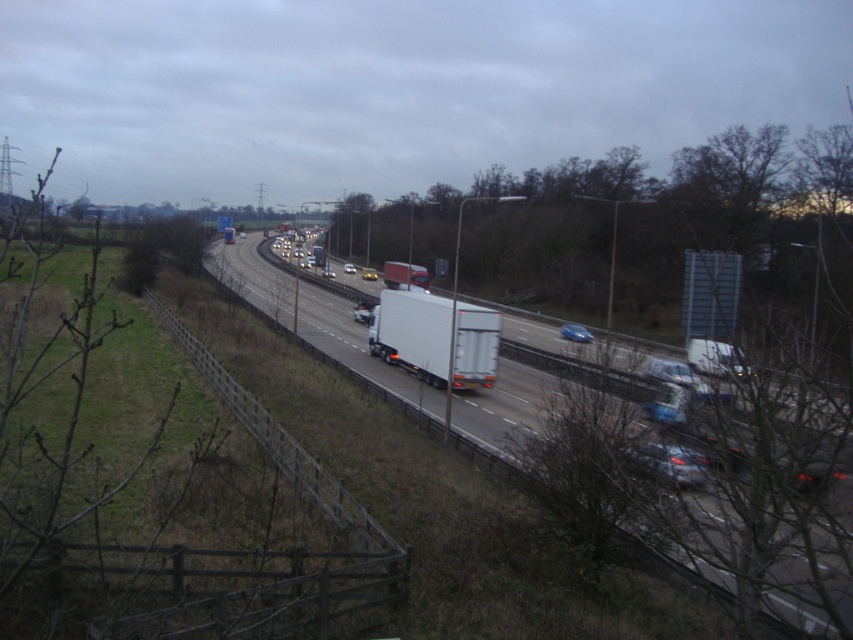
Is white matte trailer truck at center smaller than white matte truck at center?

No.

Is white matte trailer truck at center to the left of white matte truck at center from the viewer's perspective?

No, white matte trailer truck at center is not to the left of white matte truck at center.

Is point (392, 324) in front of point (363, 300)?

Yes, it is in front of point (363, 300).

Image resolution: width=853 pixels, height=640 pixels. I want to click on white matte trailer truck at center, so click(412, 332).

Between point (575, 333) and point (361, 300), which one is positioned in front?

Point (575, 333)

Does blue metallic sedan at center have a smaller size compared to white matte truck at center?

Correct, blue metallic sedan at center occupies less space than white matte truck at center.

Is point (566, 333) behind point (374, 304)?

No, (566, 333) is closer to viewer.

Where is `blue metallic sedan at center`? This screenshot has width=853, height=640. blue metallic sedan at center is located at coordinates pos(575,332).

Which is behind, point (447, 323) or point (363, 276)?

The point (363, 276) is more distant.

Who is more forward, [416,353] or [363,268]?

Point [416,353] is in front.

At what (x,y) coordinates should I click in order to perform the action: click on white matte trailer truck at center. Please return your answer as a coordinate pair (x, y). Looking at the image, I should click on (412, 332).